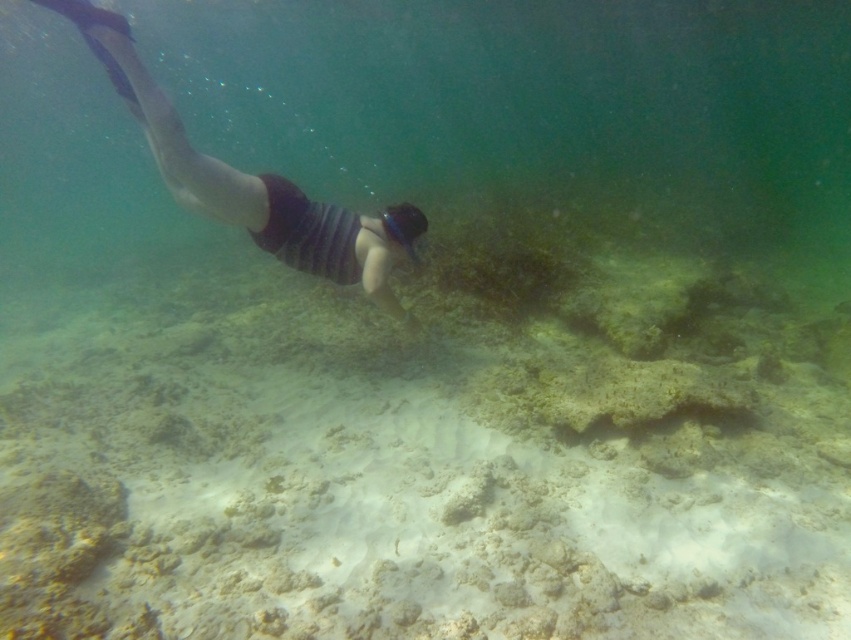
Question: Can you confirm if striped fabric snorkeler at upper left is positioned to the right of transparent plastic goggles at center?

Choices:
 (A) yes
 (B) no

Answer: (B)

Question: Is striped fabric snorkeler at upper left thinner than transparent plastic goggles at center?

Choices:
 (A) yes
 (B) no

Answer: (B)

Question: Which of the following is the closest to the observer?

Choices:
 (A) transparent plastic goggles at center
 (B) striped fabric snorkeler at upper left

Answer: (B)

Question: Does striped fabric snorkeler at upper left have a lesser width compared to transparent plastic goggles at center?

Choices:
 (A) no
 (B) yes

Answer: (A)

Question: Which point is farther to the camera?

Choices:
 (A) striped fabric snorkeler at upper left
 (B) transparent plastic goggles at center

Answer: (B)

Question: Which point appears farthest from the camera in this image?

Choices:
 (A) (136, 83)
 (B) (400, 209)

Answer: (B)